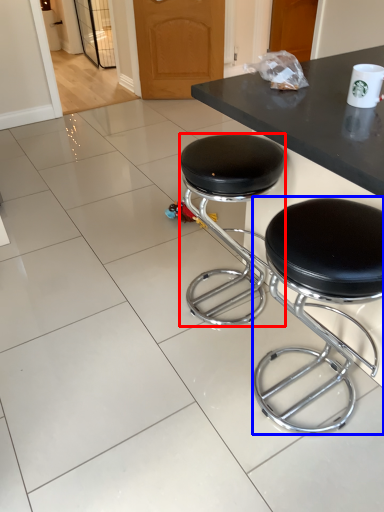
Question: Which object is further to the camera taking this photo, stool (highlighted by a red box) or stool (highlighted by a blue box)?

Choices:
 (A) stool
 (B) stool

Answer: (A)